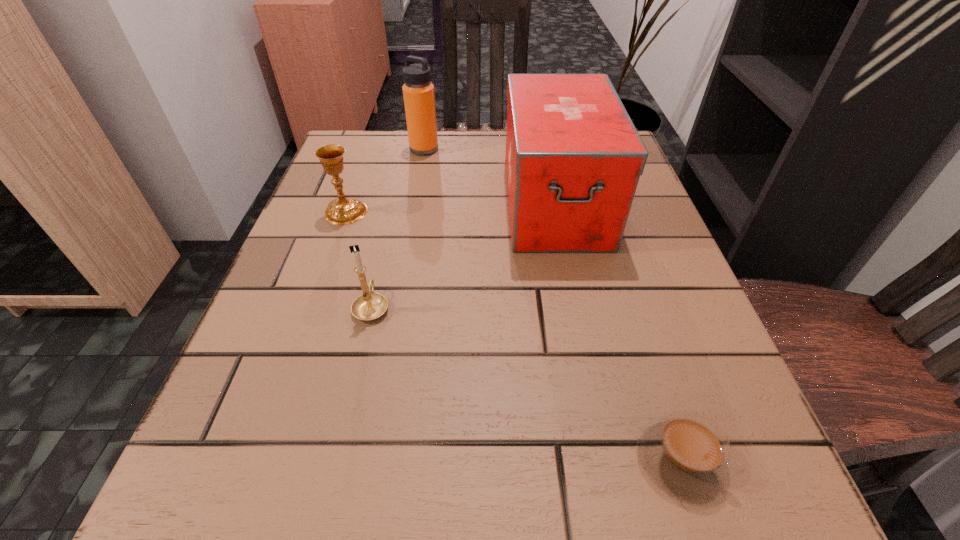
Identify the location of free space between the farthest object and the nearest object. (552, 305).

At what (x,y) coordinates should I click in order to perform the action: click on vacant area that lies between the first-aid kit and the nearest object. Please return your answer as a coordinate pair (x, y). This screenshot has width=960, height=540. Looking at the image, I should click on (618, 332).

Identify which object is located as the third nearest to the fourth farthest object. Please provide its 2D coordinates. Your answer should be formatted as a tuple, i.e. [(x, y)], where the tuple contains the x and y coordinates of a point satisfying the conditions above.

[(685, 454)]

Find the location of a particular element. object that is the closest to the leftmost object is located at coordinates (369, 306).

I want to click on vacant point that satisfies the following two spatial constraints: 1. on the front side of the cappuccino; 2. on the right side of the farthest object, so click(x=369, y=460).

Where is `free spot that satisfies the following two spatial constraints: 1. on the back side of the chalice; 2. on the left side of the farthest object`? free spot that satisfies the following two spatial constraints: 1. on the back side of the chalice; 2. on the left side of the farthest object is located at coordinates (368, 149).

What are the coordinates of `free spot that satisfies the following two spatial constraints: 1. on the handle side of the thermos bottle; 2. on the right side of the second nearest object` in the screenshot? It's located at (408, 149).

Identify the location of free space in the image that satisfies the following two spatial constraints: 1. on the handle side of the farthest object; 2. on the right side of the second nearest object. The image size is (960, 540). (408, 149).